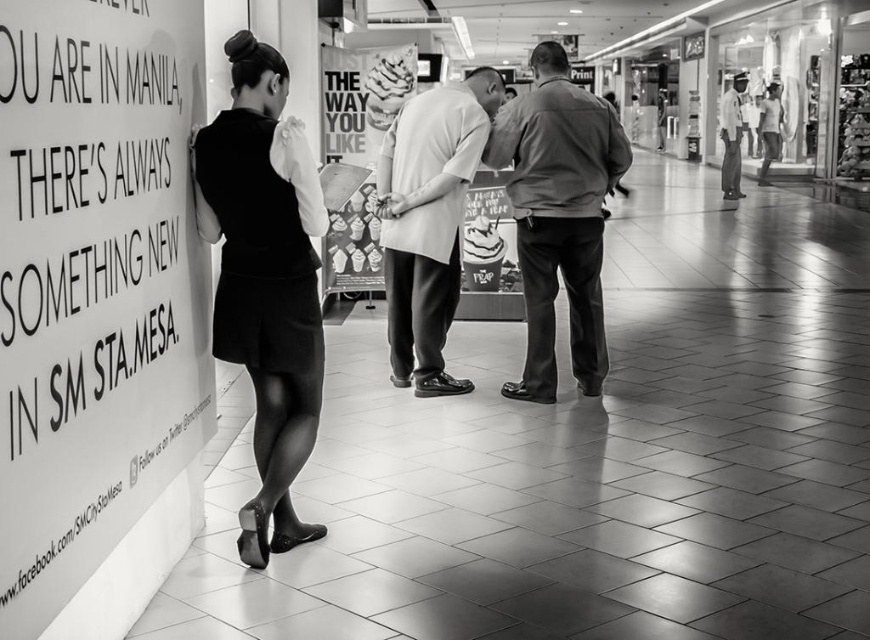
Question: Does smooth paper sign at left appear under matte black dress at left?

Choices:
 (A) no
 (B) yes

Answer: (A)

Question: Which point is farther from the camera taking this photo?

Choices:
 (A) (519, 234)
 (B) (44, 484)

Answer: (A)

Question: Can you confirm if smooth brown shirt at center is thinner than light blue uniform at center?

Choices:
 (A) yes
 (B) no

Answer: (B)

Question: Does smooth paper sign at left come in front of smooth brown shirt at center?

Choices:
 (A) yes
 (B) no

Answer: (A)

Question: Which object is farther from the camera taking this photo?

Choices:
 (A) smooth beige shirt at center
 (B) light blue uniform at center
 (C) smooth paper sign at left

Answer: (B)

Question: Which object is farther from the camera taking this photo?

Choices:
 (A) smooth beige shirt at center
 (B) matte black dress at left

Answer: (A)